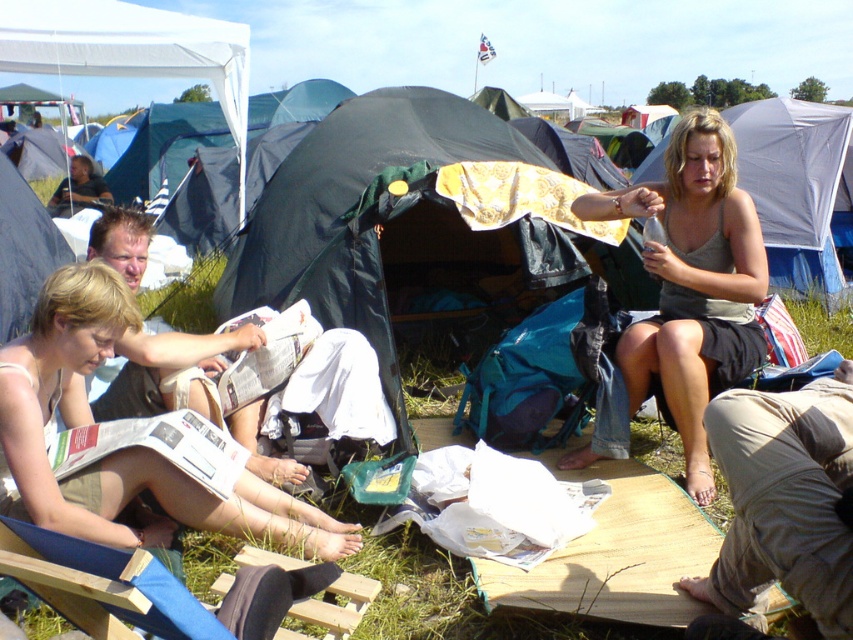
Which is behind, point (422, 189) or point (170, 596)?

Positioned behind is point (422, 189).

Is point (305, 266) positioned after point (30, 582)?

Yes, it is behind point (30, 582).

Between point (589, 240) and point (77, 592), which one is positioned behind?

Positioned behind is point (589, 240).

Image resolution: width=853 pixels, height=640 pixels. I want to click on black fabric tent at center, so click(421, 227).

Image resolution: width=853 pixels, height=640 pixels. Describe the element at coordinates (692, 284) in the screenshot. I see `matte gray tank top at center` at that location.

Between matte gray tank top at center and blue fabric folding chair at lower left, which one appears on the left side from the viewer's perspective?

blue fabric folding chair at lower left is more to the left.

Describe the element at coordinates (692, 284) in the screenshot. I see `matte gray tank top at center` at that location.

Locate an element on the screen. The height and width of the screenshot is (640, 853). matte gray tank top at center is located at coordinates (692, 284).

Does matte white newspaper at lower left have a smaller size compared to blue fabric folding chair at lower left?

Actually, matte white newspaper at lower left might be larger than blue fabric folding chair at lower left.

In the scene shown: Which is below, matte white newspaper at lower left or blue fabric folding chair at lower left?

blue fabric folding chair at lower left is lower down.

You are a GUI agent. You are given a task and a screenshot of the screen. Output one action in this format:
    pyautogui.click(x=<x>, y=<y>)
    Task: Click on the matte white newspaper at lower left
    
    Given the screenshot: What is the action you would take?
    pyautogui.click(x=126, y=436)